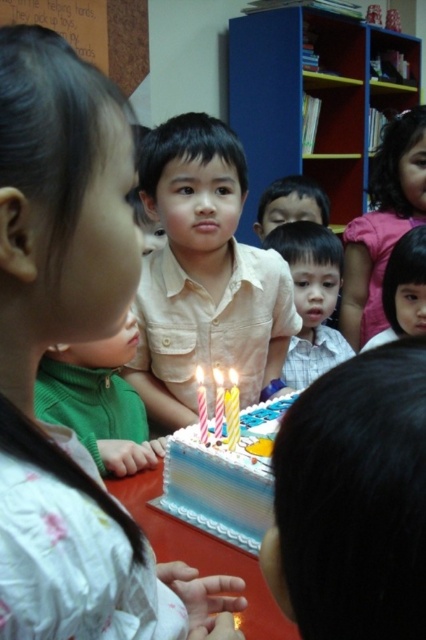
You are standing at the entrance of the room and want to find the matte yellow shirt at center. According to the coordinates given, where should you look relative to the center of the image?

The matte yellow shirt at center is located at coordinates point (204, 275), which is slightly to the left and below the center of the image.

You are a photographer taking a picture of the birthday cake. The yellow wax candle at center is lit and casting a shadow. Based on the candle location, where would the shadow fall on the table? Please provide coordinates in the format of a point like this example format of 0.5,0.5. The table is represented as a rectangle from coordinates 0.0 to 1.0 in both x and y axes.

The shadow of the yellow wax candle at center would fall at approximately the same coordinates as the candle itself, which is at point (x=201, y=404). Since the candle is at the center, the shadow would likely be directly below it unless there is an external light source altering its direction, but the scene description does not mention any such light sources.

In the scene shown: You are a photographer taking a picture of the birthday scene. You notice the matte yellow shirt at center and the smooth skin face at center. Which object should you focus on to ensure both are in frame without moving the camera?

Both the matte yellow shirt at center and the smooth skin face at center are positioned at the center of the scene, so focusing on the center will keep both in frame without needing to move the camera.